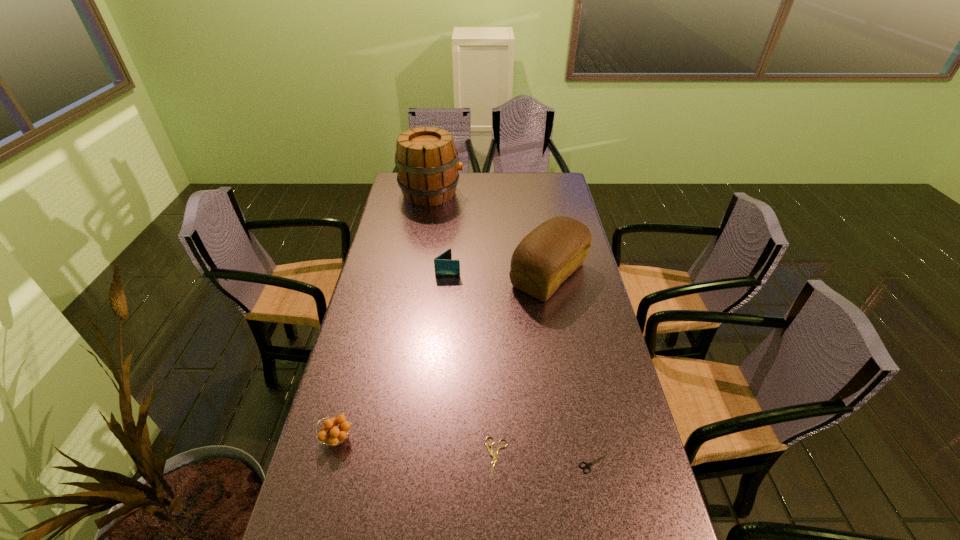
Where is `vacant space that satisfies the following two spatial constraints: 1. on the side of the tallest object where the spigot is located; 2. on the back side of the left shears`? vacant space that satisfies the following two spatial constraints: 1. on the side of the tallest object where the spigot is located; 2. on the back side of the left shears is located at coordinates (389, 457).